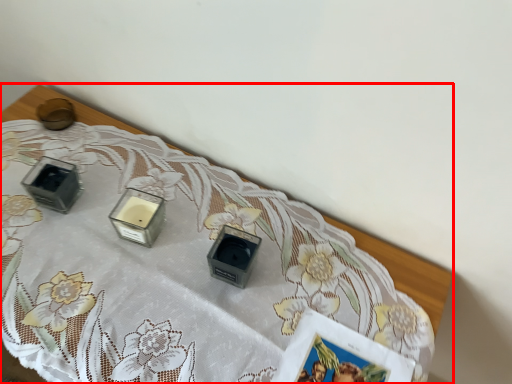
Question: In this image, where is table (annotated by the red box) located relative to candle holder?

Choices:
 (A) left
 (B) right

Answer: (B)